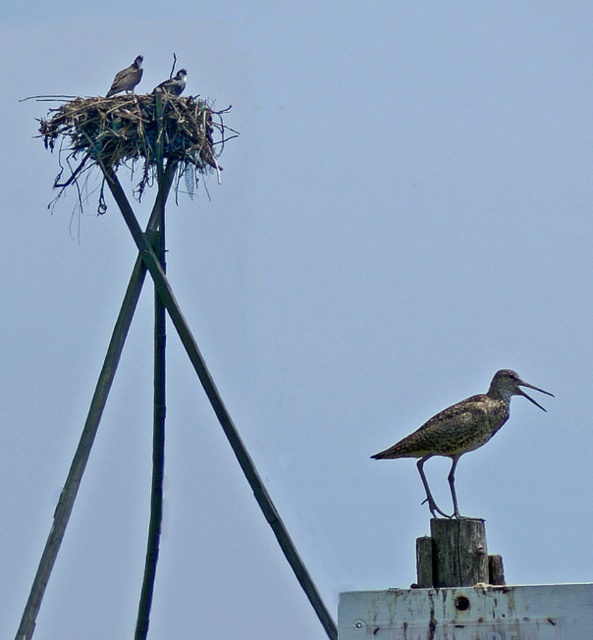
What are the coordinates of the speckled feathered bird at center?

The speckled feathered bird at center is located at coordinates point (460,429).

You are a birdwatcher observing the speckled feathered bird at center and the brown speckled bird at upper left in the image. Which bird would cast a longer shadow if the sun is directly overhead?

The speckled feathered bird at center is much taller as brown speckled bird at upper left, so it would cast a longer shadow.